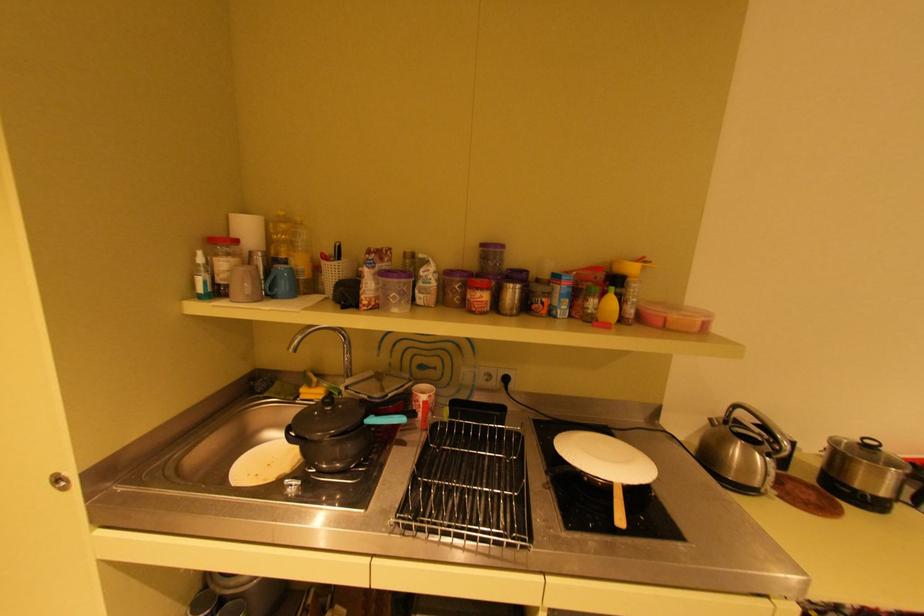
Find where to lift the kettle lid handle. Please return your answer as a coordinate pair (x, y).

(760, 426)